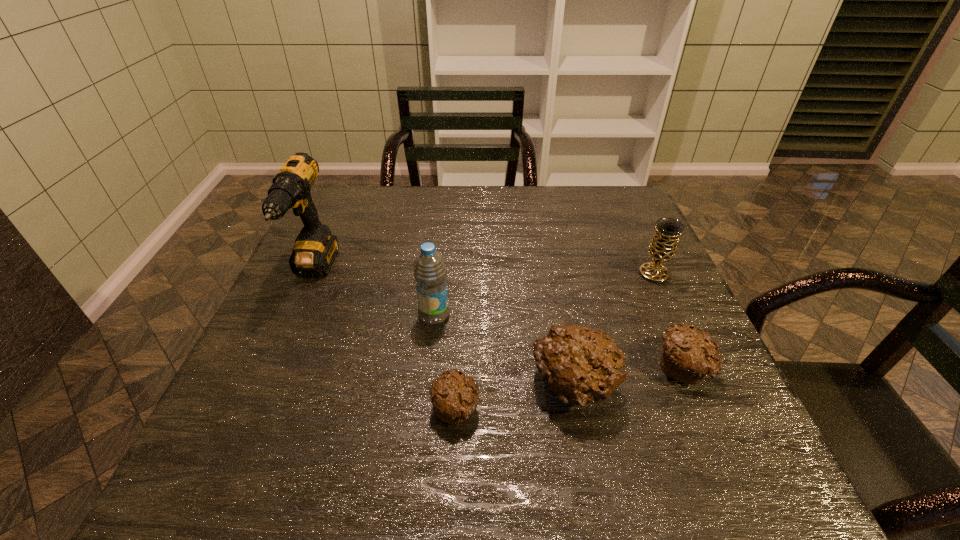
Image resolution: width=960 pixels, height=540 pixels. I want to click on the leftmost muffin, so (454, 396).

Where is `the shortest object`? The image size is (960, 540). the shortest object is located at coordinates (454, 396).

You are a GUI agent. You are given a task and a screenshot of the screen. Output one action in this format:
    pyautogui.click(x=<x>, y=<y>)
    Task: Click on the fourth object from left to right
    
    Given the screenshot: What is the action you would take?
    pyautogui.click(x=580, y=365)

Find the location of a particular element. The image size is (960, 540). the second muffin from right to left is located at coordinates (580, 365).

You are a GUI agent. You are given a task and a screenshot of the screen. Output one action in this format:
    pyautogui.click(x=<x>, y=<y>)
    Task: Click on the second shortest object
    Image resolution: width=960 pixels, height=540 pixels.
    Given the screenshot: What is the action you would take?
    pyautogui.click(x=688, y=355)

This screenshot has height=540, width=960. Identify the location of the second tallest muffin. (688, 355).

At what (x,y) coordinates should I click in order to perform the action: click on the second tallest object. Please return your answer as a coordinate pair (x, y). This screenshot has width=960, height=540. Looking at the image, I should click on (429, 271).

Identify the location of the third farthest object. (429, 271).

Find the location of a particular element. drill is located at coordinates [315, 248].

This screenshot has height=540, width=960. Find the location of `the leftmost object`. the leftmost object is located at coordinates (315, 248).